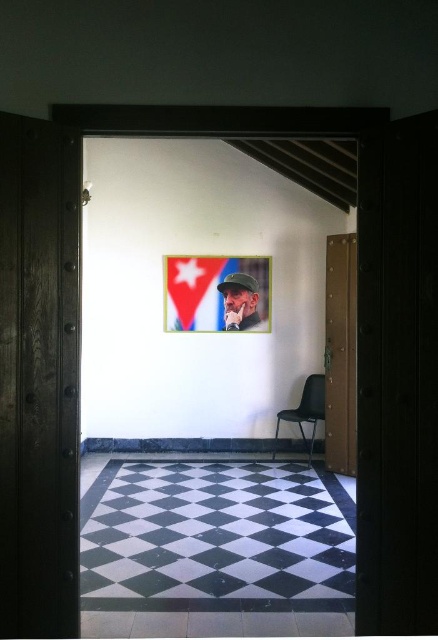
You are a delivery person with a 4 feet wide box. You need to move through the space between the matte cardboard poster at center and the black plastic chair at center to reach the door. Can you fit through the space with your box?

The distance between the matte cardboard poster at center and the black plastic chair at center is 3.60 feet. Since your box is 4 feet wide, it is wider than the available space. You cannot fit through the space with your box.

You are standing in front of the open wooden door and see two points marked in the room. Which point, point (228, 320) or point (292, 417), is closer to you?

Point (228, 320) is further to the camera than point (292, 417), so the closer point to you is point (292, 417).

Looking at this image, you are a guest entering the room through the open wooden door and see both the matte black portrait at center and the black plastic chair at center. Which object is shorter in height?

The matte black portrait at center is not as tall as the black plastic chair at center, so the matte black portrait at center is shorter in height.